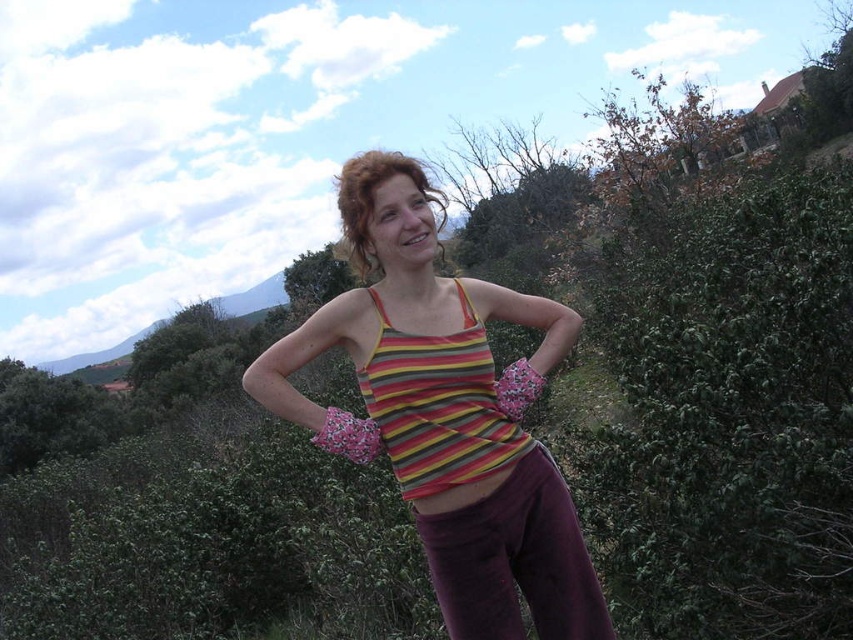
Question: In this image, where is striped fabric tank top at center located relative to striped fabric hip at center?

Choices:
 (A) left
 (B) right

Answer: (A)

Question: Which object is closer to the camera taking this photo?

Choices:
 (A) striped fabric tank top at center
 (B) striped fabric bikini top at center
 (C) green leafy hedge at right

Answer: (A)

Question: Which of the following is the farthest from the observer?

Choices:
 (A) (448, 429)
 (B) (515, 461)

Answer: (B)

Question: Can you confirm if striped fabric tank top at center is thinner than striped fabric hip at center?

Choices:
 (A) yes
 (B) no

Answer: (B)

Question: Which is nearer to the striped fabric bikini top at center?

Choices:
 (A) striped fabric hip at center
 (B) green leafy hedge at right

Answer: (A)

Question: Is green leafy hedge at right below striped fabric tank top at center?

Choices:
 (A) no
 (B) yes

Answer: (B)